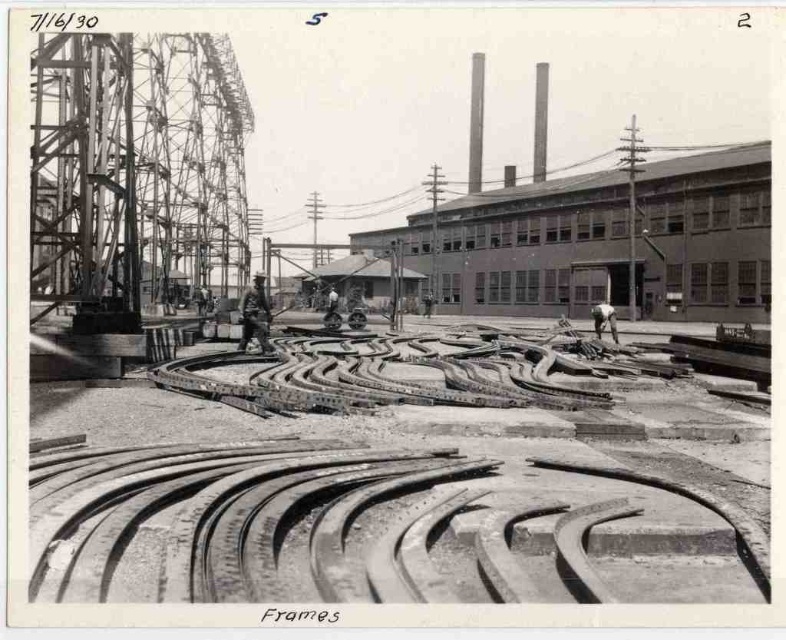
You are an inspector at the factory and need to ensure that the smooth concrete frames at center are not taller than the dark gray uniform at center. Based on the scene, does this requirement appear to be met?

The smooth concrete frames at center is not as tall as the dark gray uniform at center, so the requirement is met.

You are an inspector visiting a construction site. You notice two items at the center of the scene. Which one is closer to you, the smooth concrete frames at center or the dark gray uniform at center?

The smooth concrete frames at center is closer to you because it is in front of the dark gray uniform at center according to the description.